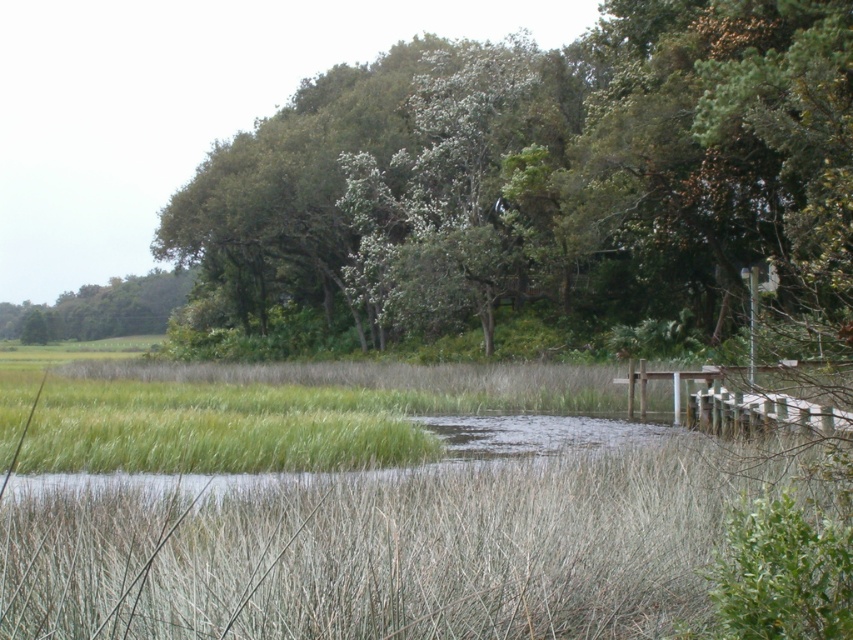
You are a bird flying over a marsh and want to land on the tallest tree. Which tree should you choose between the green leafy tree at upper center and the green leafy tree at upper left?

The green leafy tree at upper center is much taller than the green leafy tree at upper left, so you should choose the green leafy tree at upper center to land on.